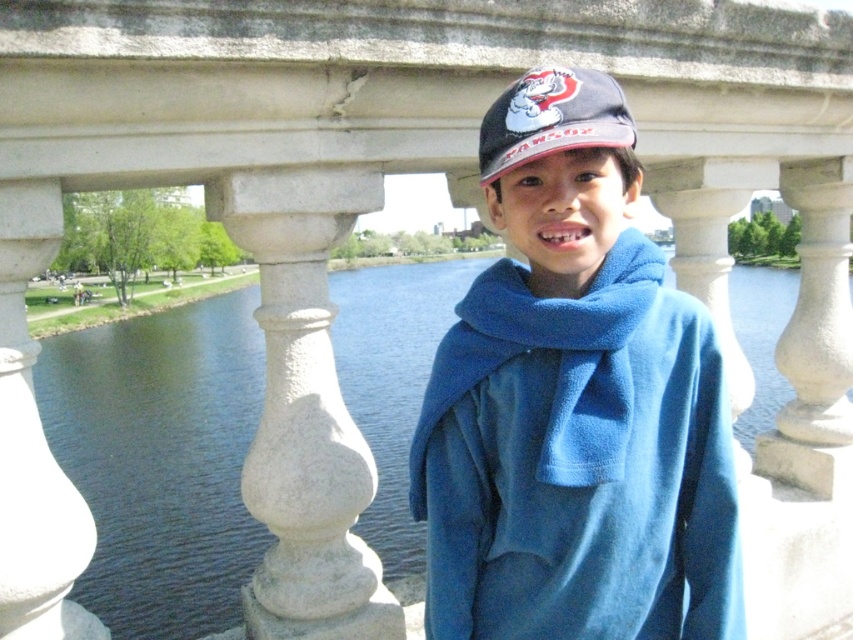
I want to click on blue fleece jacket at center, so click(x=573, y=404).

Does blue fleece jacket at center have a greater height compared to blue fleece scarf at center?

Correct, blue fleece jacket at center is much taller as blue fleece scarf at center.

Based on the photo, who is more forward, [618,464] or [543,301]?

Point [618,464]

Find the location of a particular element. This screenshot has height=640, width=853. blue fleece jacket at center is located at coordinates (573, 404).

Is point (675, 465) closer to viewer compared to point (525, 116)?

No, it is behind (525, 116).

Is blue fleece jacket at center shorter than matte black cap at center?

No.

Is point (462, 412) positioned after point (625, 118)?

Yes, point (462, 412) is behind point (625, 118).

You are a GUI agent. You are given a task and a screenshot of the screen. Output one action in this format:
    pyautogui.click(x=<x>, y=<y>)
    Task: Click on the blue fleece jacket at center
    
    Given the screenshot: What is the action you would take?
    pyautogui.click(x=573, y=404)

Between blue fleece scarf at center and matte black cap at center, which one is positioned higher?

Positioned higher is matte black cap at center.

This screenshot has height=640, width=853. What do you see at coordinates (546, 348) in the screenshot? I see `blue fleece scarf at center` at bounding box center [546, 348].

The width and height of the screenshot is (853, 640). In order to click on blue fleece scarf at center in this screenshot , I will do `click(546, 348)`.